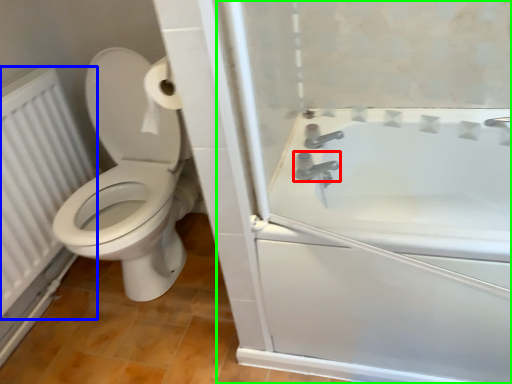
Question: Estimate the real-world distances between objects in this image. Which object is closer to tap (highlighted by a red box), radiator (highlighted by a blue box) or screen door (highlighted by a green box)?

Choices:
 (A) radiator
 (B) screen door

Answer: (B)